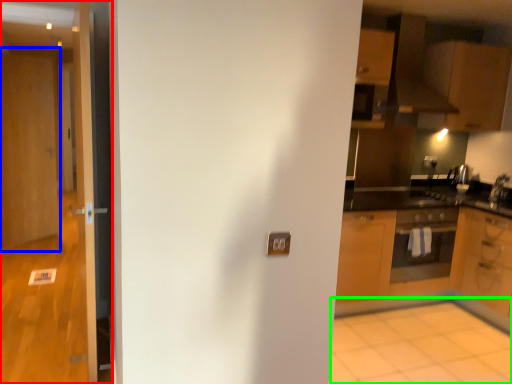
Question: Which object is positioned farthest from door (highlighted by a red box)? Select from door (highlighted by a blue box) and plain (highlighted by a green box).

Choices:
 (A) door
 (B) plain

Answer: (A)